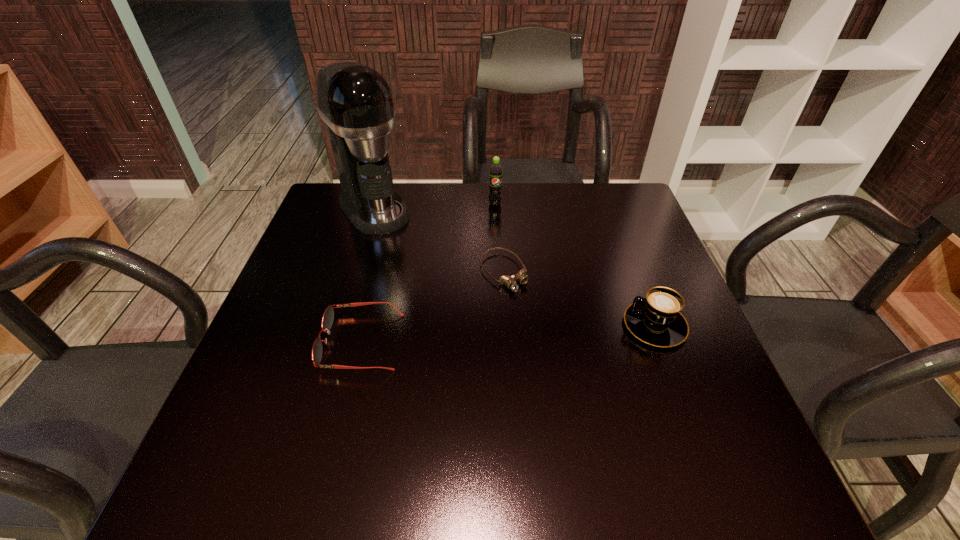
At what (x,y) coordinates should I click in order to perform the action: click on coffee maker at the far edge. Please return your answer as a coordinate pair (x, y). Looking at the image, I should click on (355, 101).

Identify the location of soda present at the far edge. coord(495,185).

This screenshot has height=540, width=960. Find the location of `spectacles that is at the left edge`. spectacles that is at the left edge is located at coordinates (327, 320).

You are a GUI agent. You are given a task and a screenshot of the screen. Output one action in this format:
    pyautogui.click(x=<x>, y=<y>)
    Task: Click on the coffee maker at the left edge
    This screenshot has height=540, width=960.
    Given the screenshot: What is the action you would take?
    pyautogui.click(x=355, y=101)

Identify the location of object situated at the right edge. (656, 320).

Identify the location of object that is at the far left corner. Image resolution: width=960 pixels, height=540 pixels. (355, 101).

In the image, there is a desktop. Where is `vacant space at the far edge`? vacant space at the far edge is located at coordinates (469, 226).

Where is `free space at the near edge of the desktop`? Image resolution: width=960 pixels, height=540 pixels. free space at the near edge of the desktop is located at coordinates point(342,402).

At what (x,y) coordinates should I click in order to perform the action: click on vacant space at the left edge. Please return your answer as a coordinate pair (x, y). This screenshot has width=960, height=540. Looking at the image, I should click on (328, 235).

Find the location of a particular element. The image size is (960, 540). free space at the right edge is located at coordinates (642, 258).